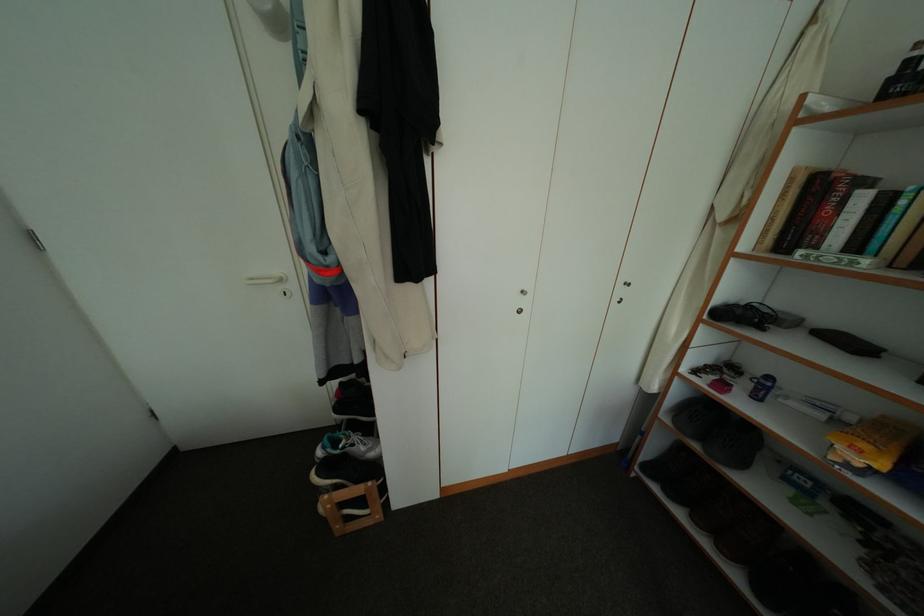
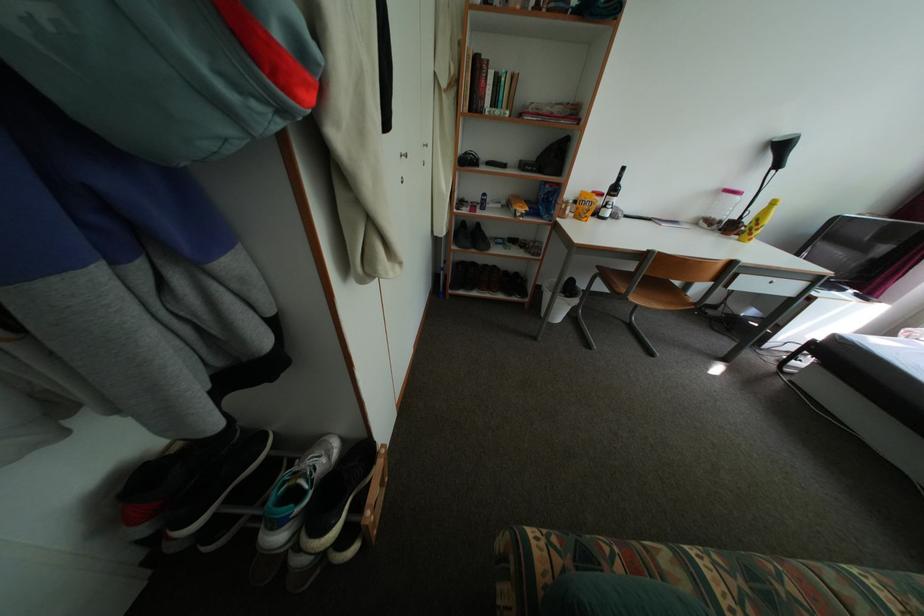
The images are taken continuously from a first-person perspective. In which direction is your viewpoint rotating?

The camera's rotation is toward right-down.